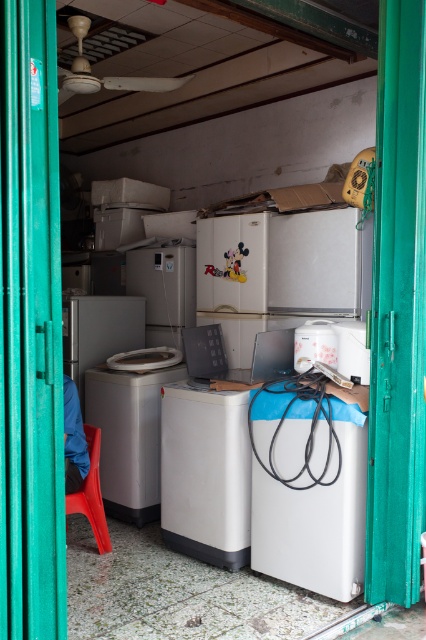
Between green fabric curtain at right and satin white washing machine at center, which one appears on the left side from the viewer's perspective?

Positioned to the left is satin white washing machine at center.

Which is behind, point (405, 280) or point (184, 404)?

The point (184, 404) is behind.

Find the location of a particular element. Image resolution: width=426 pixels, height=640 pixels. green fabric curtain at right is located at coordinates (397, 310).

Is white glossy washing machine at center below satin white washing machine at center?

Actually, white glossy washing machine at center is above satin white washing machine at center.

Locate an element on the screen. white glossy washing machine at center is located at coordinates (307, 486).

Is point (316, 502) behind point (201, 547)?

No, it is in front of (201, 547).

Identify the location of white glossy washing machine at center. pyautogui.click(x=307, y=486).

Is green fabric curtain at left wider than white glossy washing machine at center?

No, green fabric curtain at left is not wider than white glossy washing machine at center.

Is green fabric curtain at left further to camera compared to white glossy washing machine at center?

That is False.

Identify the location of green fabric curtain at left. The image size is (426, 640). (31, 328).